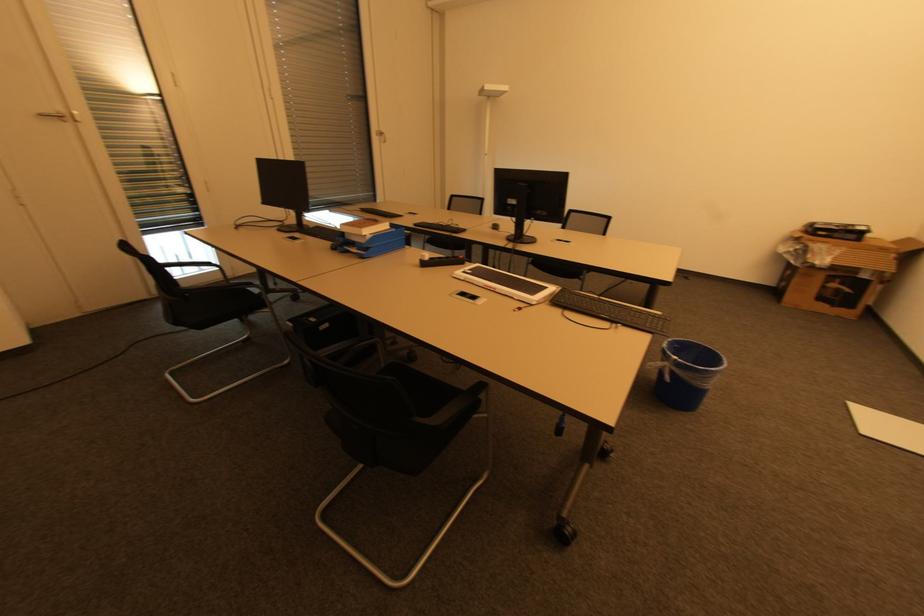
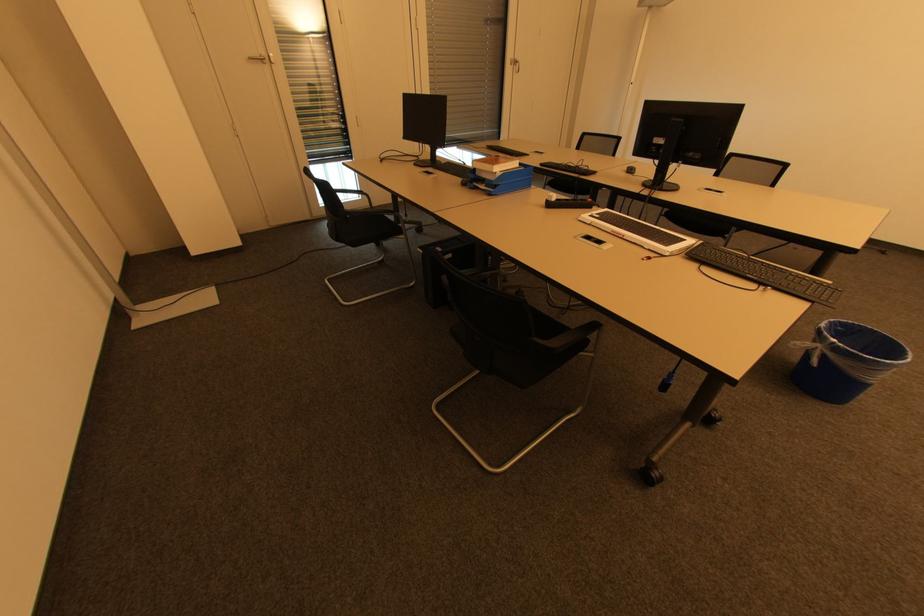
Where in the second image is the point corresponding to (440,419) from the first image?

(556, 344)